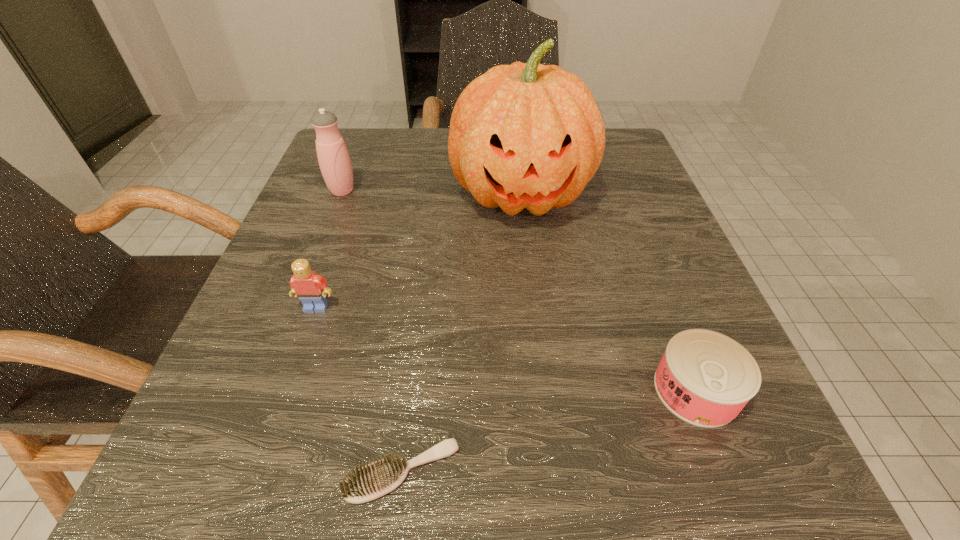
Image resolution: width=960 pixels, height=540 pixels. I want to click on the tallest object, so click(526, 135).

You are a GUI agent. You are given a task and a screenshot of the screen. Output one action in this format:
    pyautogui.click(x=<x>, y=<y>)
    Task: Click on the fourth shortest object
    The height and width of the screenshot is (540, 960).
    Given the screenshot: What is the action you would take?
    pyautogui.click(x=333, y=157)

Where is `the third shortest object`? This screenshot has width=960, height=540. the third shortest object is located at coordinates (311, 289).

The width and height of the screenshot is (960, 540). I want to click on Lego, so click(311, 289).

Where is `the rightmost object`? This screenshot has height=540, width=960. the rightmost object is located at coordinates (705, 378).

At what (x,y) coordinates should I click in order to perform the action: click on the second nearest object. Please return your answer as a coordinate pair (x, y). Looking at the image, I should click on (705, 378).

Image resolution: width=960 pixels, height=540 pixels. Identify the location of scrubbing brush. (380, 477).

Locate an element on the screen. The width and height of the screenshot is (960, 540). the nearest object is located at coordinates (380, 477).

Where is `free space located on the carved face of the tallest object`? This screenshot has height=540, width=960. free space located on the carved face of the tallest object is located at coordinates (552, 468).

Locate an element on the screen. This screenshot has width=960, height=540. vacant space located on the back of the thermos bottle is located at coordinates (359, 147).